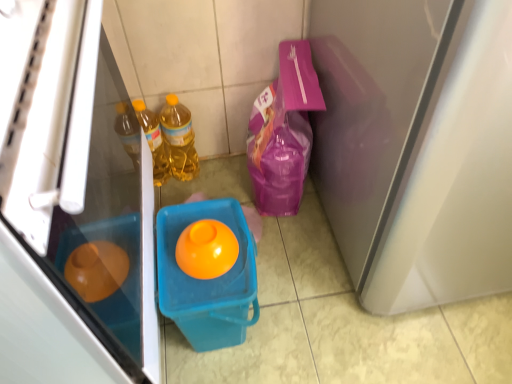
Where is `vacant point above translucent plastic bucket at center (from a real-world perspective)`? The width and height of the screenshot is (512, 384). vacant point above translucent plastic bucket at center (from a real-world perspective) is located at coordinates point(192,268).